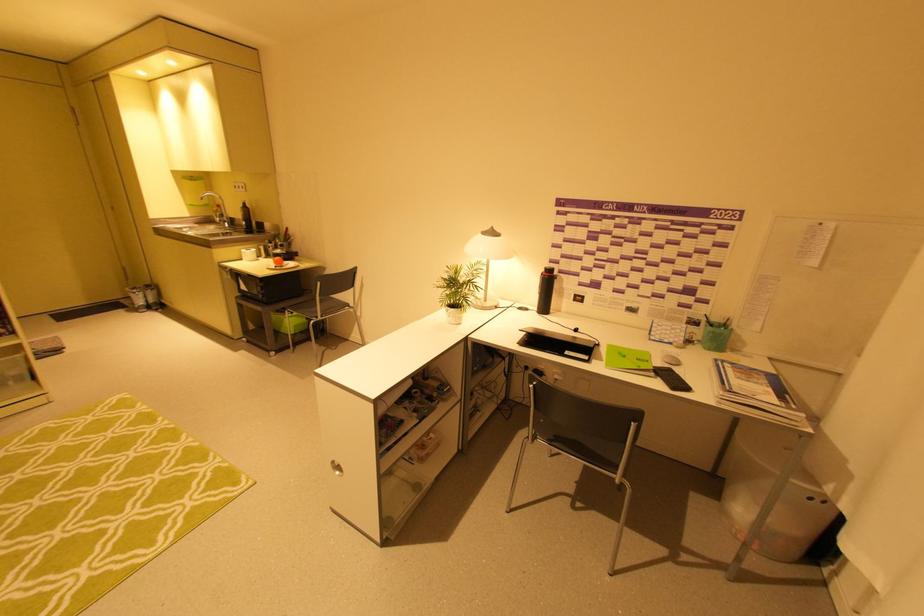
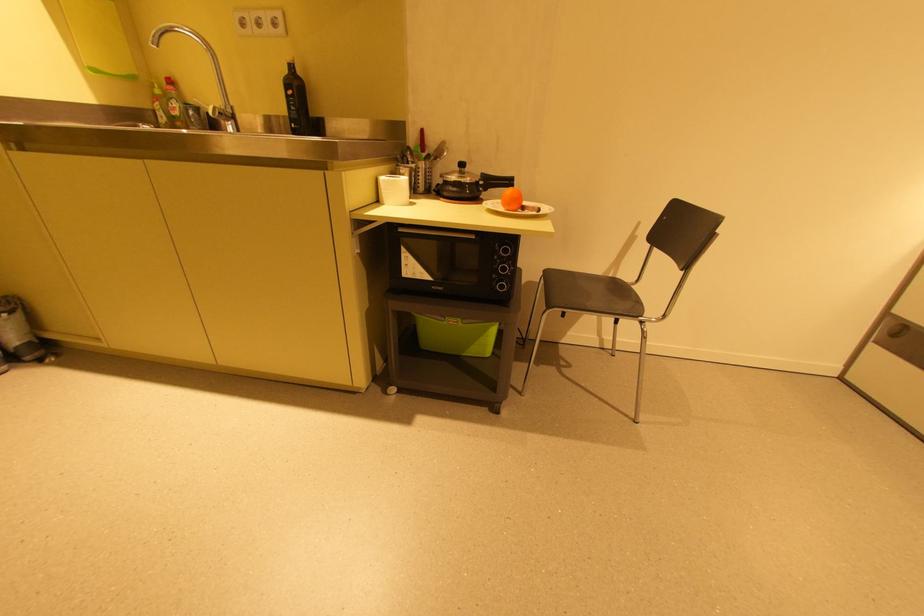
Locate, in the second image, the point that corresponds to point 242,188 in the first image.

(263, 23)